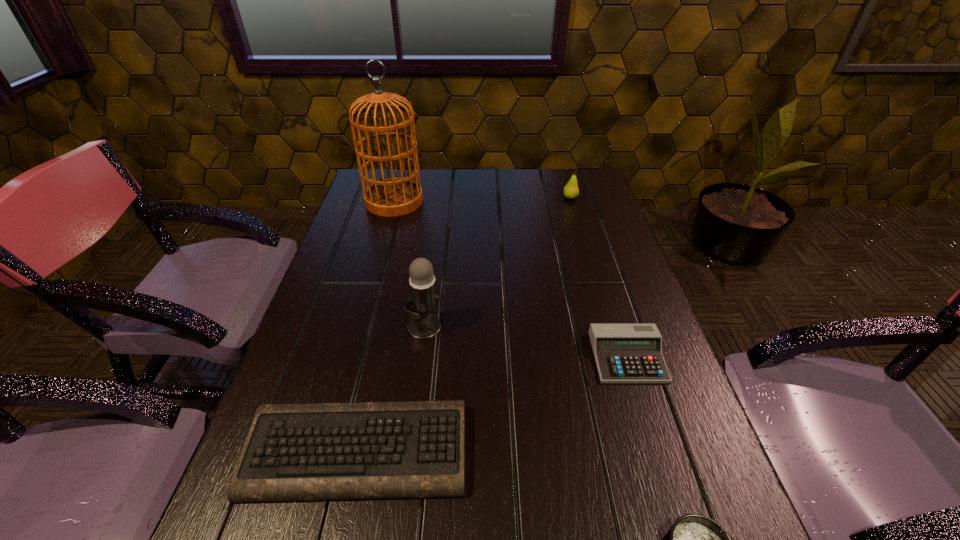
This screenshot has height=540, width=960. Identify the location of birdcage that is at the far edge. (390, 197).

I want to click on pear that is at the far edge, so click(x=571, y=191).

Locate an element on the screen. The height and width of the screenshot is (540, 960). birdcage located in the left edge section of the desktop is located at coordinates (390, 197).

At what (x,y) coordinates should I click in order to perform the action: click on computer keyboard present at the left edge. Please return your answer as a coordinate pair (x, y). The height and width of the screenshot is (540, 960). Looking at the image, I should click on (372, 450).

The height and width of the screenshot is (540, 960). In order to click on pear located in the right edge section of the desktop in this screenshot , I will do `click(571, 191)`.

Locate an element on the screen. This screenshot has height=540, width=960. calculator that is at the right edge is located at coordinates (624, 352).

This screenshot has width=960, height=540. I want to click on object at the far left corner, so click(x=390, y=197).

The image size is (960, 540). I want to click on object that is at the far right corner, so click(571, 191).

Locate an element on the screen. This screenshot has width=960, height=540. free region at the far edge of the desktop is located at coordinates (441, 171).

Identify the location of vacant space at the left edge of the desktop. The height and width of the screenshot is (540, 960). (297, 520).